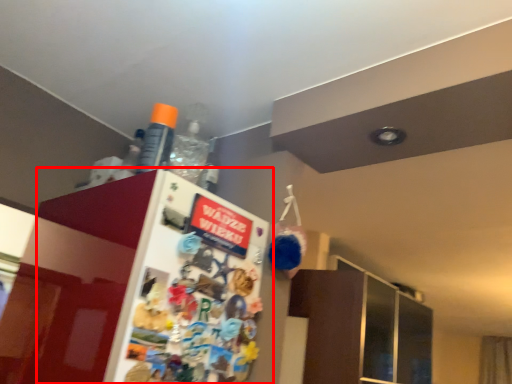
Question: From the image, what is the correct spatial relationship of fridge (annotated by the red box) in relation to bottle?

Choices:
 (A) right
 (B) left

Answer: (A)